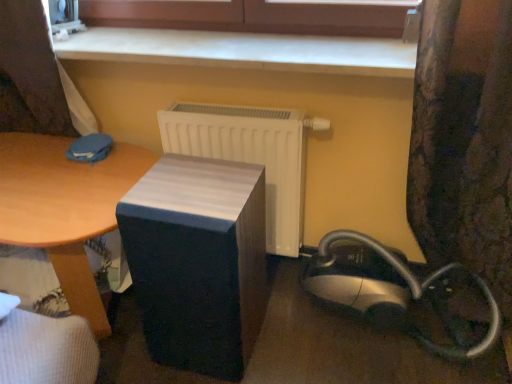
This screenshot has height=384, width=512. Identify the location of vacant space underneath smooth wood surface at upper center (from a real-world perspective). (180, 34).